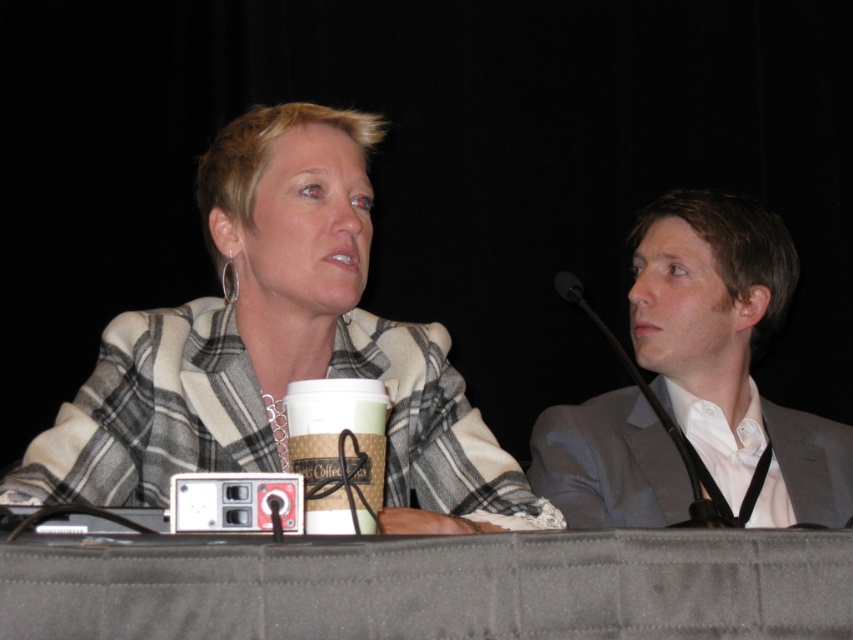
You are a stagehand preparing to adjust the microphone stand for the panel discussion. The black matte microphone at right is currently positioned 16.53 inches away from the plaid fabric jacket at center. If the recommended distance between a microphone and a speaker is 12 inches for optimal sound quality, should you move the microphone closer or farther away?

The distance between the plaid fabric jacket at center and the black matte microphone at right is 16.53 inches, which is 4.53 inches beyond the recommended 12 inches. To achieve optimal sound quality, you should move the microphone closer to the plaid fabric jacket at center by approximately 4.53 inches.

You are a stagehand preparing to adjust the microphone stand for the next speaker. The black matte microphone at right is currently positioned 17.99 inches away from the brown paper cup at center. If the ideal distance between the microphone and the speaker is 18 inches, should you move the microphone closer or farther away?

The brown paper cup at center and black matte microphone at right are 17.99 inches apart. Since the ideal distance is 18 inches, the microphone is slightly too close. Therefore, you should move the black matte microphone at right about 0.01 inches farther away to achieve the ideal distance.